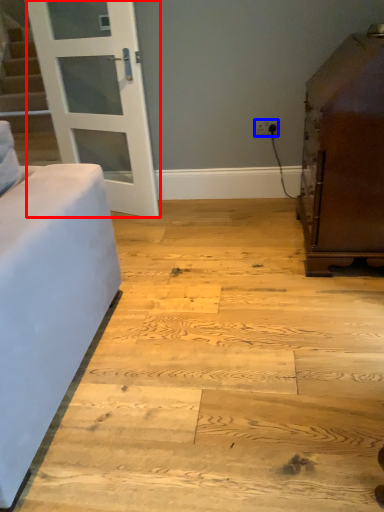
Question: Which of the following is the closest to the observer, door (highlighted by a red box) or electric outlet (highlighted by a blue box)?

Choices:
 (A) door
 (B) electric outlet

Answer: (A)